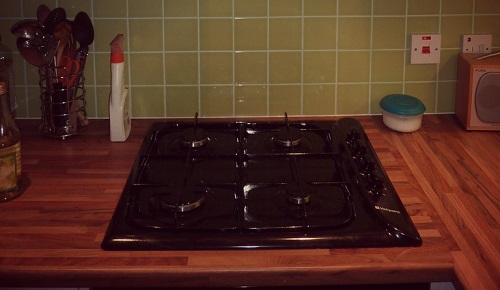
Where is `spoons`? The width and height of the screenshot is (500, 290). spoons is located at coordinates (31, 51), (33, 35), (47, 21), (61, 25), (81, 28), (69, 51).